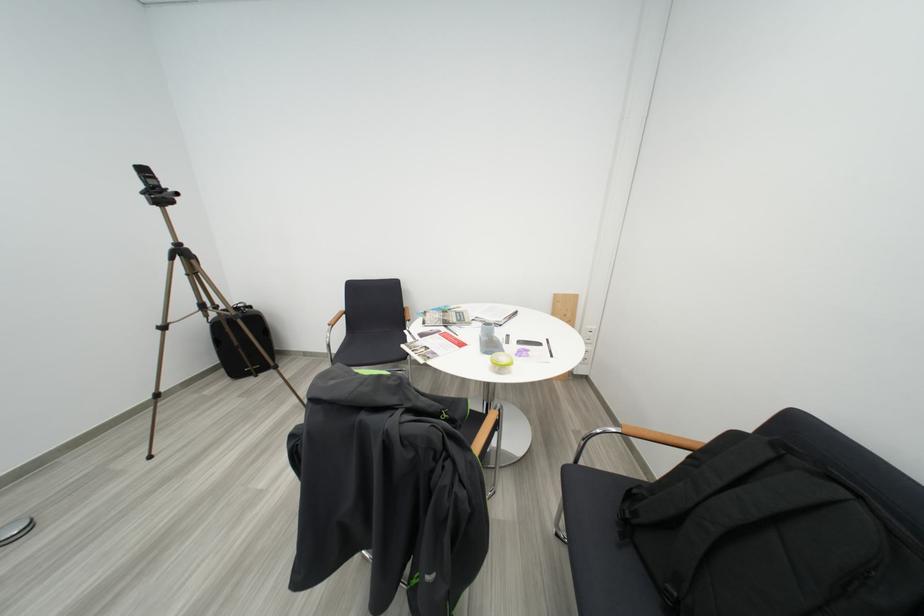
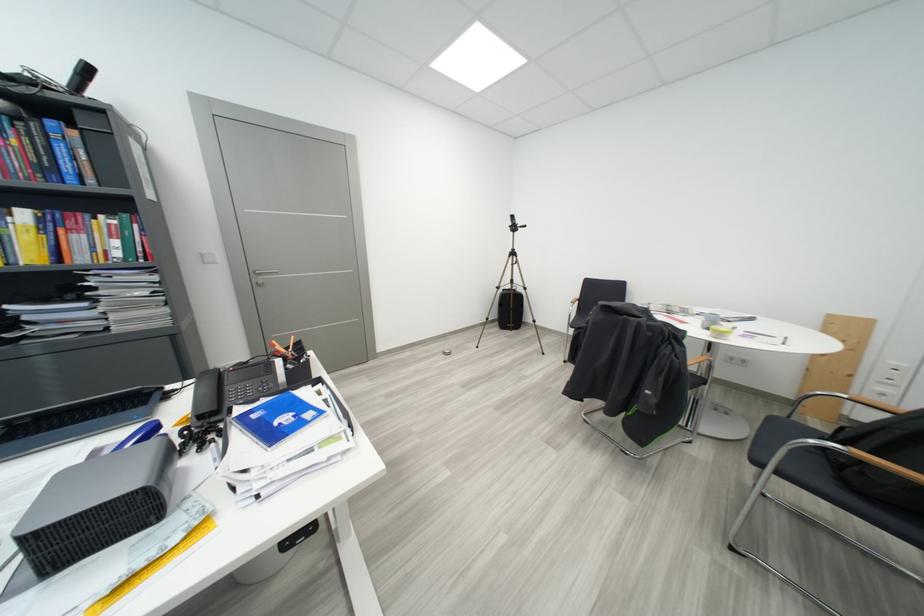
Where in the second image is the point corresponding to (x=173, y=330) from the first image?

(506, 291)